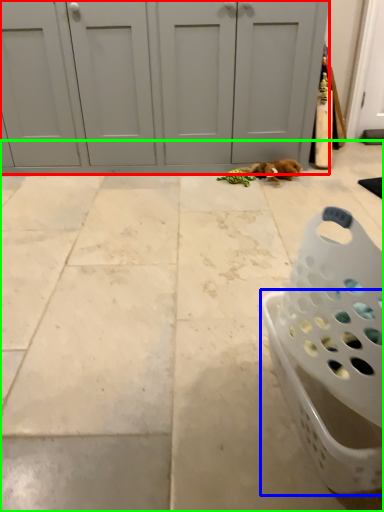
Question: Considering the real-world distances, which object is farthest from door (highlighted by a red box)? basket (highlighted by a blue box) or concrete (highlighted by a green box)?

Choices:
 (A) basket
 (B) concrete

Answer: (A)